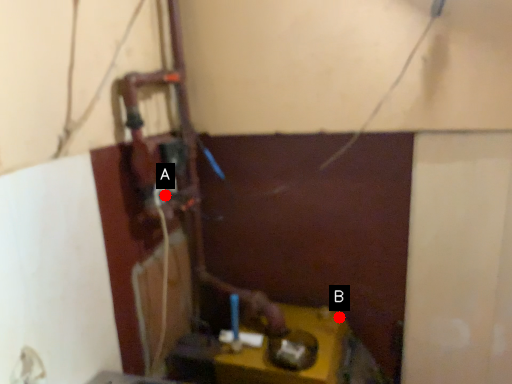
Question: Two points are circled on the image, labeled by A and B beside each circle. Which point is closer to the camera taking this photo?

Choices:
 (A) A is closer
 (B) B is closer

Answer: (A)